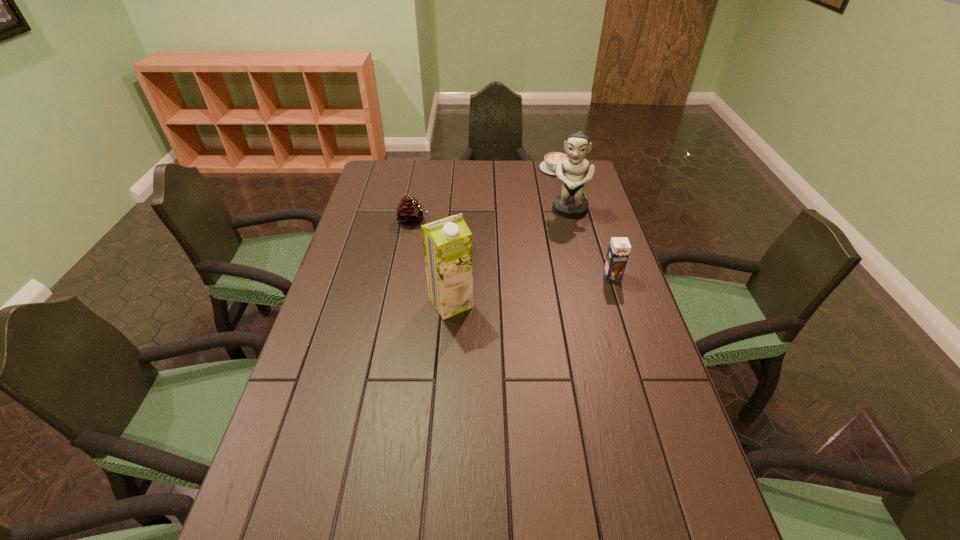
Identify the location of free spot on the desktop that is between the soya milk and the fourth farthest object and is positioned on the front-facing side of the figurine. The width and height of the screenshot is (960, 540). (546, 287).

Locate an element on the screen. The width and height of the screenshot is (960, 540). vacant space on the desktop that is between the second object from left to right and the second nearest object and is positioned on the side of the cappuccino with the handle is located at coordinates (518, 292).

Image resolution: width=960 pixels, height=540 pixels. I want to click on vacant spot on the desktop that is between the soya milk and the chocolate milk and is positioned with a leaf charm attached to the leftmost object, so click(521, 292).